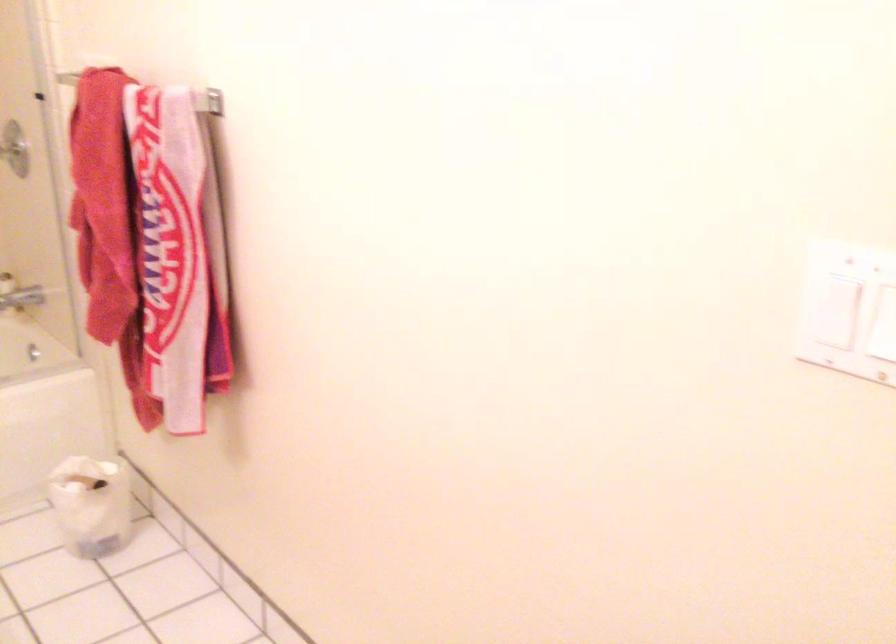
The height and width of the screenshot is (644, 896). I want to click on small trash can, so click(90, 505).